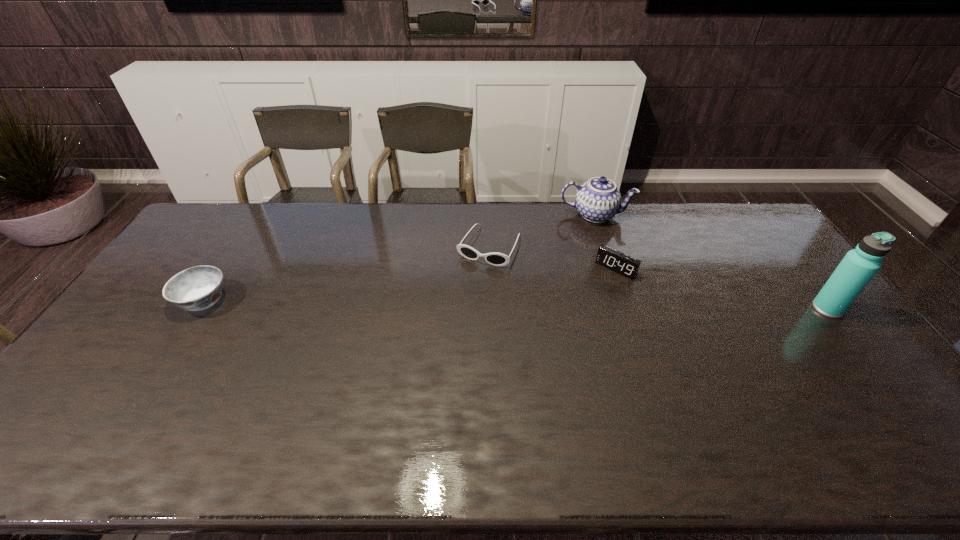
Locate an element on the screen. This screenshot has height=540, width=960. object that is at the left edge is located at coordinates (196, 288).

At what (x,y) coordinates should I click in order to perform the action: click on object that is at the right edge. Please return your answer as a coordinate pair (x, y). This screenshot has height=540, width=960. Looking at the image, I should click on (x=858, y=267).

Where is `free point at the far edge`? This screenshot has width=960, height=540. free point at the far edge is located at coordinates (660, 215).

In the image, there is a desktop. Find the location of `vacant space at the near edge`. vacant space at the near edge is located at coordinates (658, 393).

Find the location of a particular element. The image size is (960, 540). blank area at the left edge is located at coordinates (134, 333).

Find the location of `free space that is in between the ashtray and the rightmost object`. free space that is in between the ashtray and the rightmost object is located at coordinates (516, 305).

The width and height of the screenshot is (960, 540). I want to click on blank region between the thermos bottle and the chinaware, so click(x=711, y=262).

Image resolution: width=960 pixels, height=540 pixels. I want to click on vacant area that lies between the sunglasses and the chinaware, so click(x=542, y=231).

This screenshot has height=540, width=960. In order to click on empty location between the sunglasses and the chinaware in this screenshot , I will do `click(542, 231)`.

Locate an element on the screen. The height and width of the screenshot is (540, 960). vacant space in between the ashtray and the tallest object is located at coordinates (516, 305).